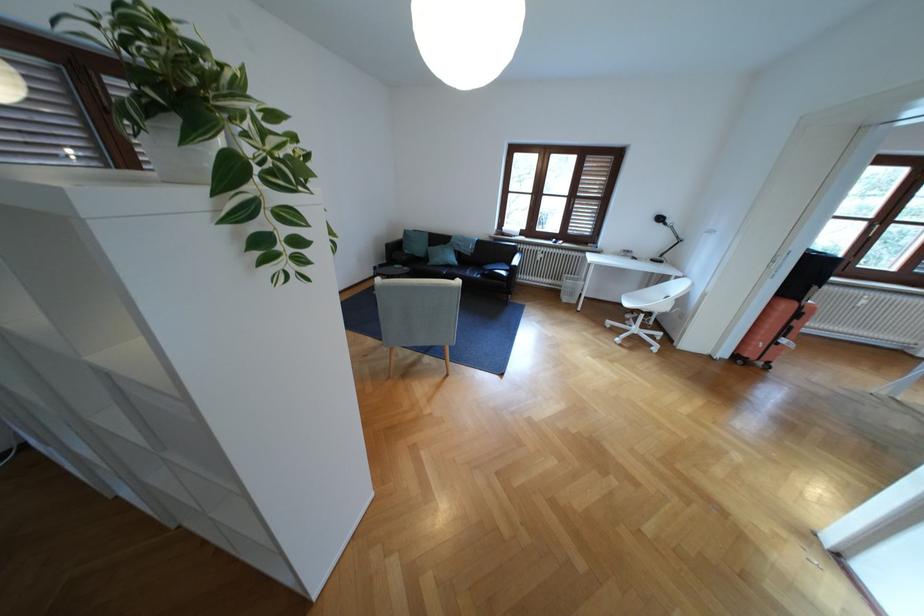
Where would you resting arm the sofa armrest? Please return your answer as a coordinate pair (x, y).

(516, 260)